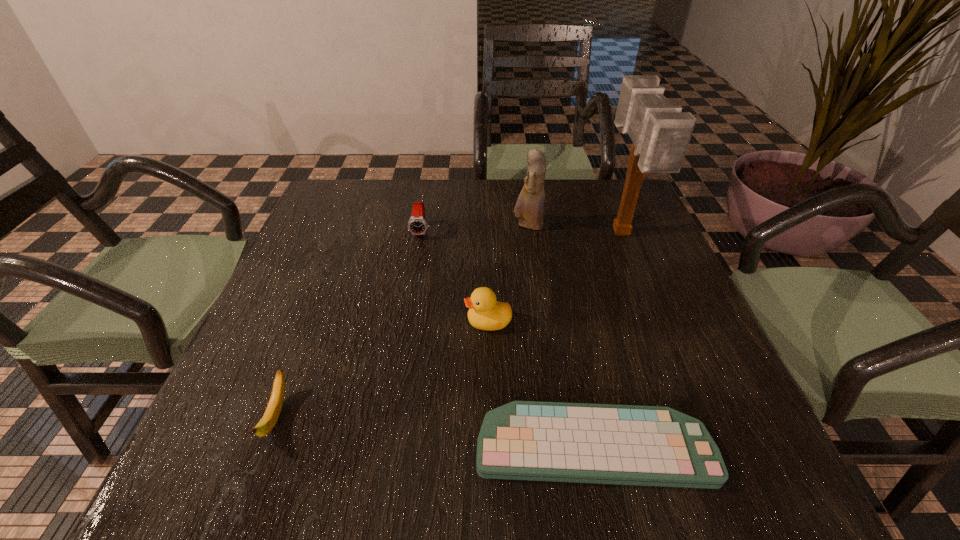
What are the coordinates of `vacant space at the right edge` in the screenshot? It's located at (689, 307).

Find the location of a particular element. The width and height of the screenshot is (960, 540). vacant space at the far left corner is located at coordinates (332, 183).

This screenshot has width=960, height=540. I want to click on vacant space at the near left corner of the desktop, so click(263, 474).

Identify the location of vacant space at the far right corner of the desktop. This screenshot has width=960, height=540. (589, 207).

Find the location of `unoccupied area between the fourth farthest object and the leftmost object`. unoccupied area between the fourth farthest object and the leftmost object is located at coordinates (382, 369).

You are a GUI agent. You are given a task and a screenshot of the screen. Output one action in this format:
    pyautogui.click(x=<x>, y=<y>)
    Task: Click on the vacant space that's between the tallest object and the third nearest object
    This screenshot has width=960, height=540.
    Given the screenshot: What is the action you would take?
    pyautogui.click(x=555, y=278)

Where is `empty space between the computer keyboard and the tallest object`? The width and height of the screenshot is (960, 540). empty space between the computer keyboard and the tallest object is located at coordinates (607, 340).

Locate an element on the screen. The width and height of the screenshot is (960, 540). vacant space in between the watch and the third nearest object is located at coordinates (455, 276).

Identify the location of vacant area that lies between the watch and the figurine. Image resolution: width=960 pixels, height=540 pixels. (474, 228).

This screenshot has width=960, height=540. In order to click on free space between the figurine and the fourth farthest object in this screenshot , I will do `click(508, 274)`.